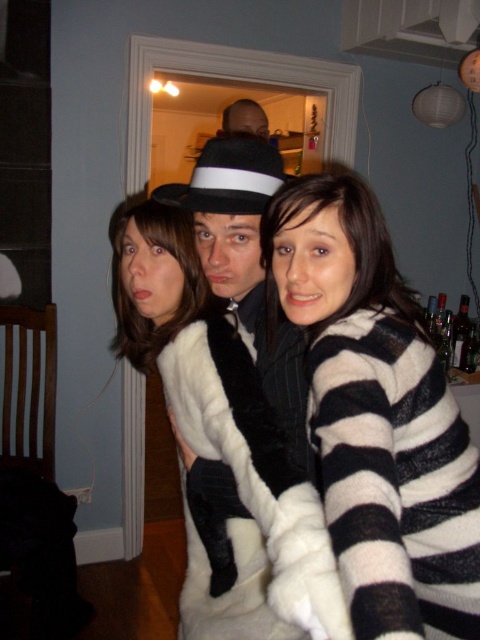
Question: Can you confirm if black and white striped sweater at center is positioned to the left of white fur coat at center?

Choices:
 (A) no
 (B) yes

Answer: (A)

Question: Which of the following is the farthest from the observer?

Choices:
 (A) (349, 540)
 (B) (204, 422)

Answer: (B)

Question: Can you confirm if black and white striped sweater at center is positioned to the right of white fur coat at center?

Choices:
 (A) yes
 (B) no

Answer: (A)

Question: Which point is closer to the camera?

Choices:
 (A) white fur coat at center
 (B) black and white striped sweater at center

Answer: (B)

Question: Is black and white striped sweater at center above white fur coat at center?

Choices:
 (A) no
 (B) yes

Answer: (B)